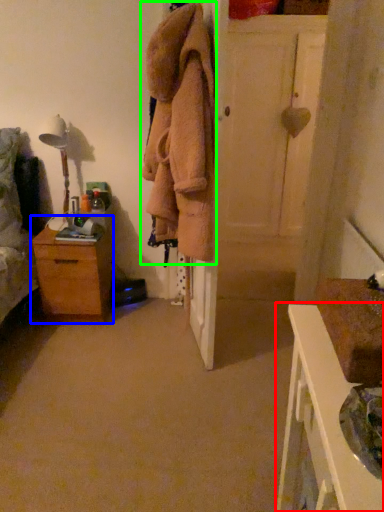
Question: Which object is positioned closest to nightstand (highlighted by a red box)? Select from chest of drawers (highlighted by a blue box) and clothing (highlighted by a green box).

Choices:
 (A) chest of drawers
 (B) clothing

Answer: (B)